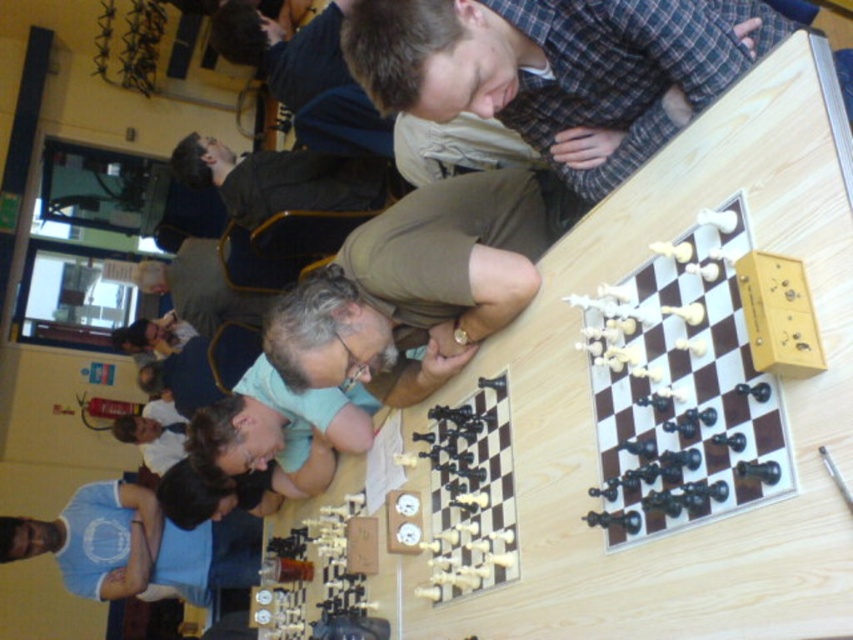
Question: Which point is closer to the camera?

Choices:
 (A) black plastic chess pieces at center
 (B) blue cotton shirt at lower left
 (C) wooden chessboard at upper right

Answer: (C)

Question: Which object appears farthest from the camera in this image?

Choices:
 (A) blue cotton shirt at lower left
 (B) wooden chessboard at upper right
 (C) black plastic chess pieces at center

Answer: (A)

Question: Can you confirm if wooden chessboard at upper right is positioned to the left of blue cotton shirt at lower left?

Choices:
 (A) yes
 (B) no

Answer: (B)

Question: From the image, what is the correct spatial relationship of wooden chessboard at upper right in relation to black plastic chess pieces at center?

Choices:
 (A) above
 (B) below

Answer: (A)

Question: Is wooden chessboard at upper right below blue cotton shirt at lower left?

Choices:
 (A) no
 (B) yes

Answer: (A)

Question: Which point is closer to the camera?

Choices:
 (A) black plastic chess pieces at center
 (B) blue cotton shirt at lower left

Answer: (A)